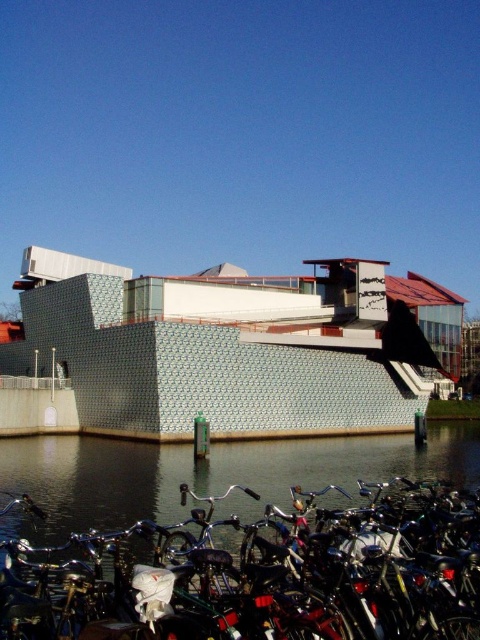
Question: Is shiny metallic bicycle at lower left thinner than dark water at lower left?

Choices:
 (A) no
 (B) yes

Answer: (B)

Question: Among these objects, which one is farthest from the camera?

Choices:
 (A) shiny metallic bicycle at lower left
 (B) dark water at lower left

Answer: (B)

Question: Is shiny metallic bicycle at lower left positioned before dark water at lower left?

Choices:
 (A) no
 (B) yes

Answer: (B)

Question: Which point is closer to the camera?

Choices:
 (A) (106, 502)
 (B) (226, 589)

Answer: (B)

Question: Does shiny metallic bicycle at lower left appear on the left side of dark water at lower left?

Choices:
 (A) yes
 (B) no

Answer: (A)